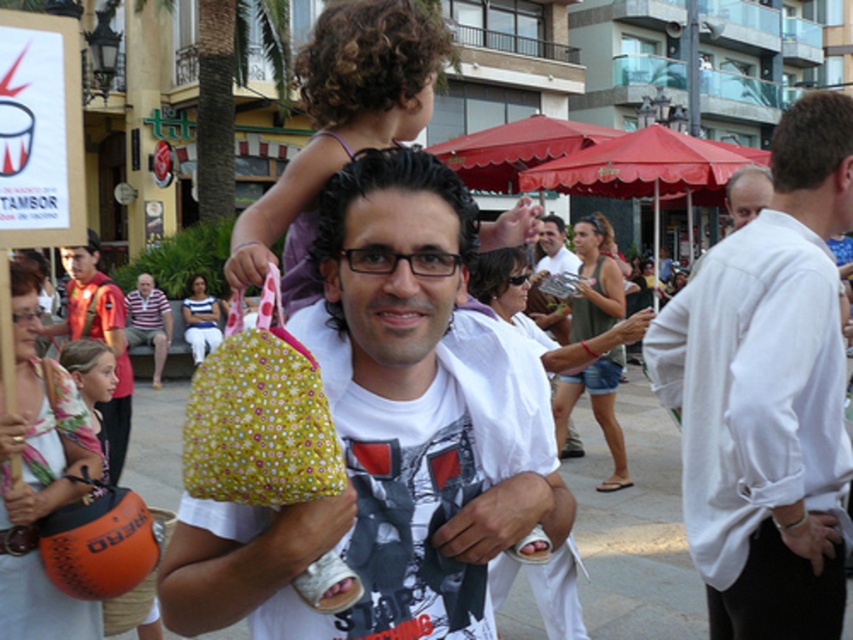
You are organizing a small festival booth and need to arrange items on a shelf. The shelf has limited space. You have the floral fabric bag at center and the orange fabric drum at lower left. Which item should you place first to ensure both fit?

The floral fabric bag at center occupies less space than the orange fabric drum at lower left, so you should place the orange fabric drum at lower left first to accommodate its larger size before placing the smaller floral fabric bag at center.

You are a visitor at this festival and want to find the location of the orange fabric drum at lower left and the white paper sign at upper left. Which object is located more to the left side of the scene?

The orange fabric drum at lower left is positioned on the left side of the white paper sign at upper left, so the orange fabric drum at lower left is more to the left.